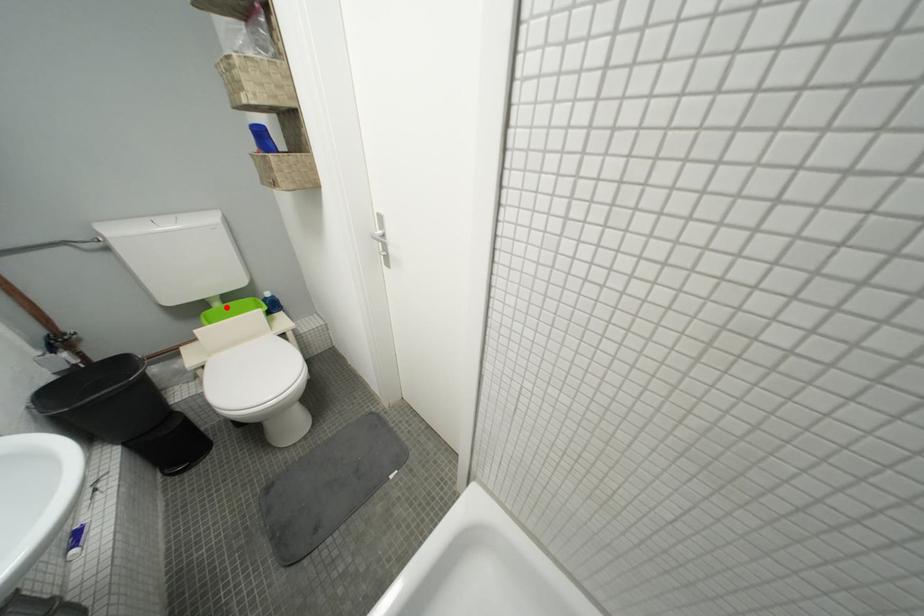
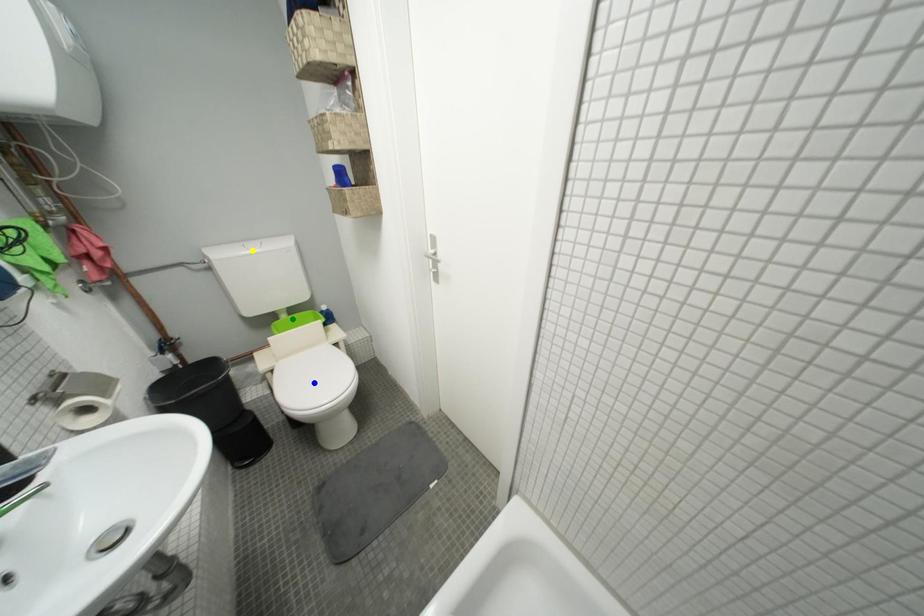
Question: I am providing you with two images of the same scene from different viewpoints. A red point is marked on the first image. You are given multiple points on the second image. Which mark in image 2 goes with the point in image 1?

Choices:
 (A) yellow point
 (B) blue point
 (C) green point

Answer: (C)